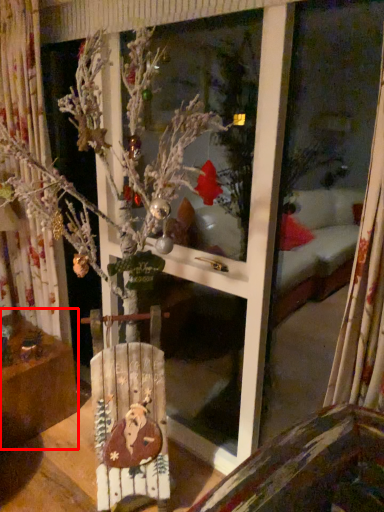
Question: From the image's perspective, where is furniture (annotated by the red box) located in relation to armchair in the image?

Choices:
 (A) above
 (B) below

Answer: (B)